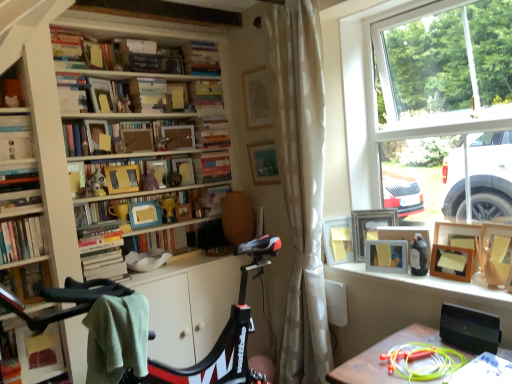
Where is `vacant area on top of green fabric desk at lower right (from a real-world perspective)`? vacant area on top of green fabric desk at lower right (from a real-world perspective) is located at coordinates (422, 361).